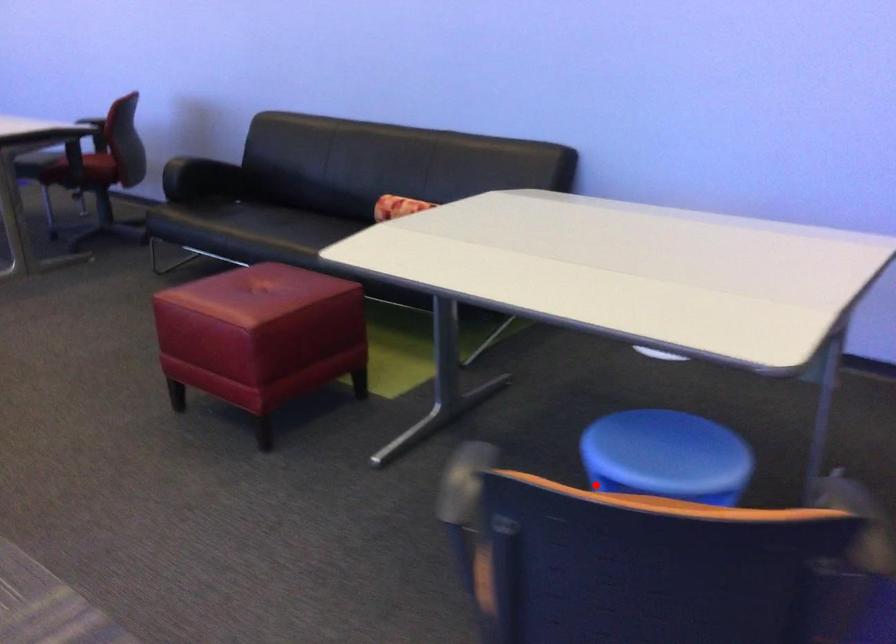
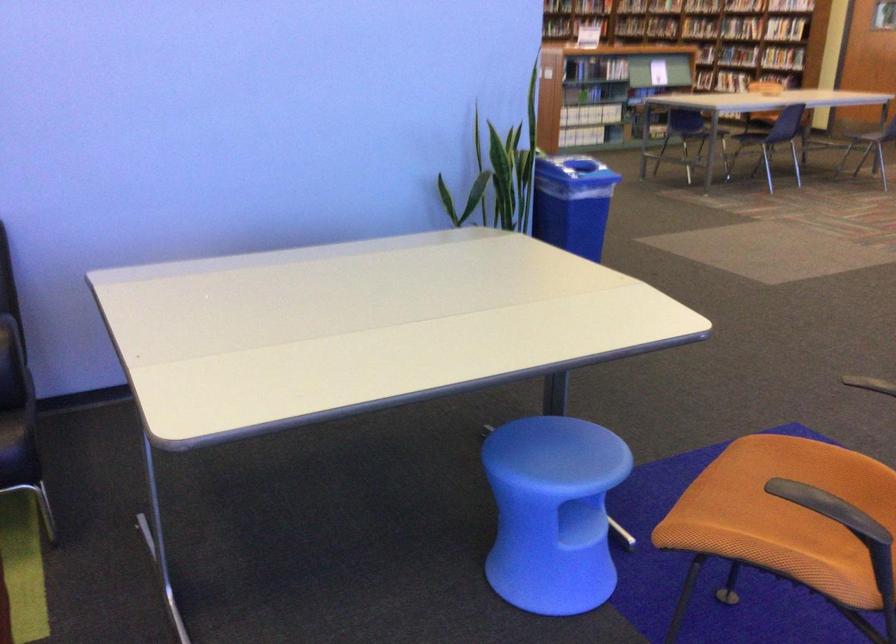
The point at the highlighted location is marked in the first image. Where is the corresponding point in the second image?

(553, 512)